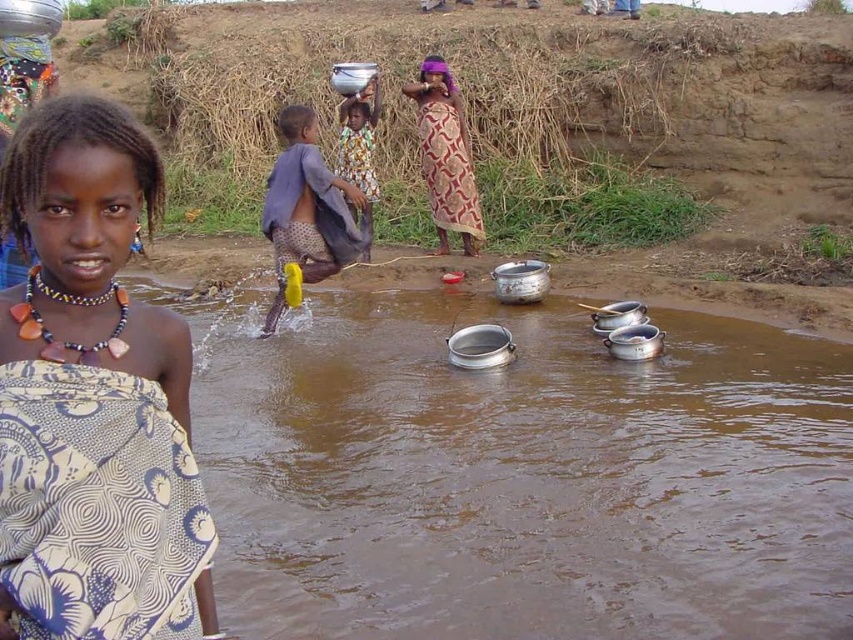
Is brown metallic pots at center behind metallic silver pot at upper center?

No, it is not.

Which is behind, point (500, 387) or point (366, 179)?

Point (366, 179)

In order to click on brown metallic pots at center in this screenshot , I will do `click(521, 476)`.

Measure the distance between patterned fabric dress at center and metallic silver pot at upper center.

A distance of 84.10 centimeters exists between patterned fabric dress at center and metallic silver pot at upper center.

Is patterned fabric dress at center thinner than metallic silver pot at upper center?

In fact, patterned fabric dress at center might be wider than metallic silver pot at upper center.

Who is more forward, (x=437, y=141) or (x=358, y=97)?

Positioned in front is point (x=437, y=141).

This screenshot has width=853, height=640. I want to click on patterned fabric dress at center, so click(x=445, y=156).

Describe the element at coordinates (521, 476) in the screenshot. The height and width of the screenshot is (640, 853). I see `brown metallic pots at center` at that location.

Is brown metallic pots at center to the left of yellow fabric cloth at center from the viewer's perspective?

No, brown metallic pots at center is not to the left of yellow fabric cloth at center.

Is point (401, 349) positioned behind point (296, 200)?

That is True.

This screenshot has width=853, height=640. I want to click on brown metallic pots at center, so click(521, 476).